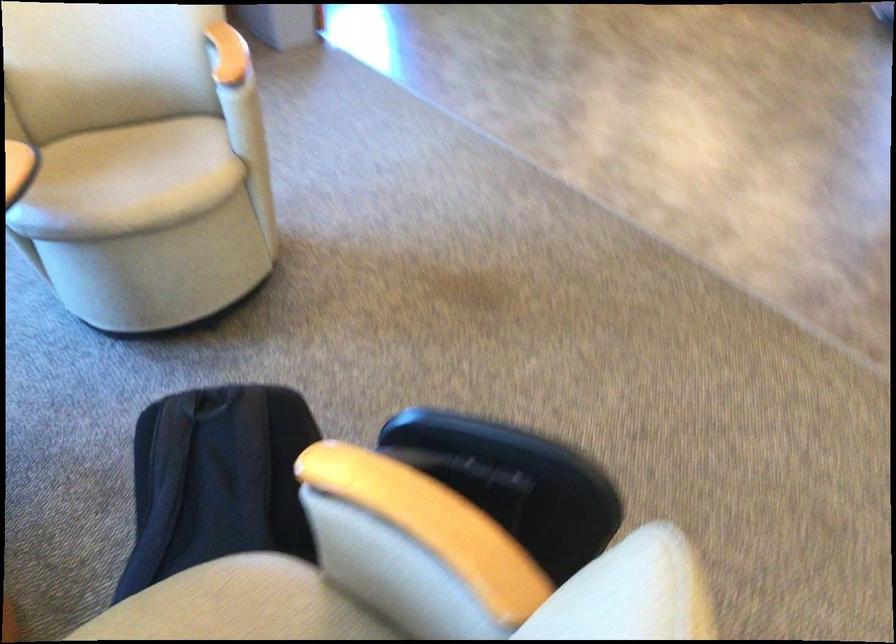
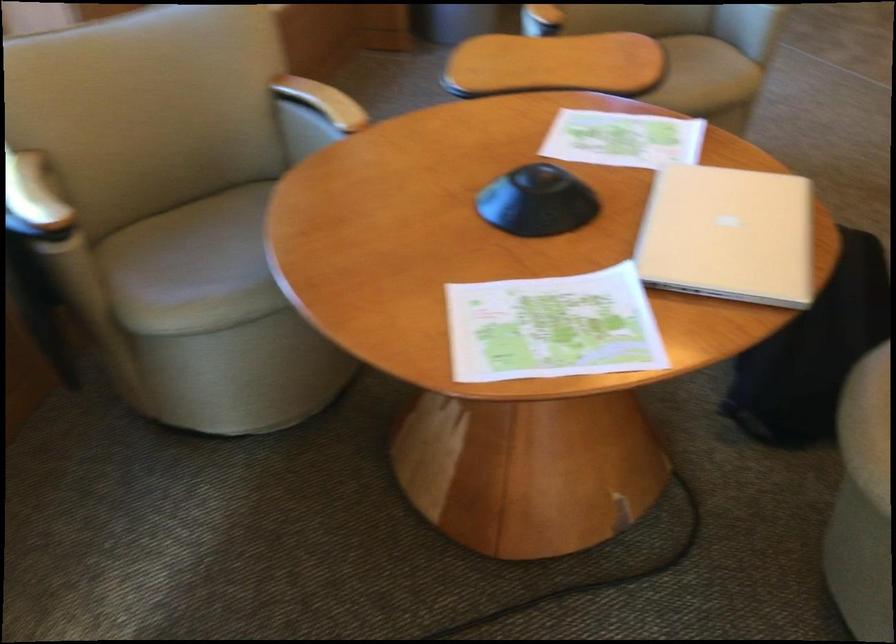
Question: I am providing you with two images of the same scene from different viewpoints. Which of the following objects are not visible in image2?

Choices:
 (A) printer control knob
 (B) wooden chair armrest
 (C) chair sitting surface
 (D) beige chair sitting surface

Answer: (C)